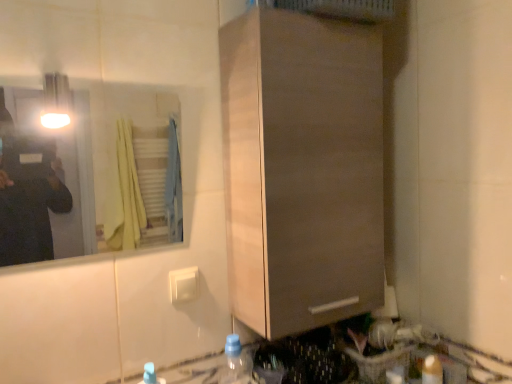
Question: Does translucent plastic bottle at lower right, the 1th bottle viewed from the right, come in front of blue translucent bottle at lower center, which is counted as the 3th bottle, starting from the right?

Choices:
 (A) no
 (B) yes

Answer: (A)

Question: From the image's perspective, is translucent plastic bottle at lower right, the 1th bottle viewed from the right, beneath blue translucent bottle at lower center, which is counted as the 3th bottle, starting from the right?

Choices:
 (A) yes
 (B) no

Answer: (A)

Question: From a real-world perspective, is translucent plastic bottle at lower right, the 1th bottle viewed from the right, on top of blue translucent bottle at lower center, which is counted as the 3th bottle, starting from the right?

Choices:
 (A) yes
 (B) no

Answer: (B)

Question: Does translucent plastic bottle at lower right, the 1th bottle viewed from the right, have a lesser width compared to blue translucent bottle at lower center, which is counted as the 3th bottle, starting from the right?

Choices:
 (A) no
 (B) yes

Answer: (B)

Question: From the image's perspective, is translucent plastic bottle at lower right, the 1th bottle viewed from the right, over blue translucent bottle at lower center, which is counted as the 3th bottle, starting from the right?

Choices:
 (A) no
 (B) yes

Answer: (A)

Question: From the image's perspective, relative to translucent plastic bottle at lower center, the 2th bottle from the right, is clear glass mirror at upper left above or below?

Choices:
 (A) above
 (B) below

Answer: (A)

Question: Do you think clear glass mirror at upper left is within translucent plastic bottle at lower center, the 2th bottle from the right, or outside of it?

Choices:
 (A) outside
 (B) inside

Answer: (A)

Question: Considering the positions of clear glass mirror at upper left and translucent plastic bottle at lower center, placed as the second bottle when sorted from left to right, in the image, is clear glass mirror at upper left wider or thinner than translucent plastic bottle at lower center, placed as the second bottle when sorted from left to right,?

Choices:
 (A) wide
 (B) thin

Answer: (B)

Question: Is point (31, 254) closer or farther from the camera than point (245, 352)?

Choices:
 (A) closer
 (B) farther

Answer: (B)

Question: From the image's perspective, is blue translucent bottle at lower center, which is counted as the 3th bottle, starting from the right, above or below translucent plastic bottle at lower center, the 2th bottle from the right?

Choices:
 (A) above
 (B) below

Answer: (A)

Question: Considering the positions of point (164, 380) and point (237, 337), is point (164, 380) closer or farther from the camera than point (237, 337)?

Choices:
 (A) farther
 (B) closer

Answer: (A)

Question: Looking at their shapes, would you say blue translucent bottle at lower center, which is counted as the 3th bottle, starting from the right, is wider or thinner than translucent plastic bottle at lower center, the 2th bottle from the right?

Choices:
 (A) thin
 (B) wide

Answer: (A)

Question: From a real-world perspective, relative to translucent plastic bottle at lower center, placed as the second bottle when sorted from left to right, is blue translucent bottle at lower center, marked as the 1th bottle in a left-to-right arrangement, vertically above or below?

Choices:
 (A) below
 (B) above

Answer: (B)

Question: Does point (250, 359) appear closer or farther from the camera than point (143, 380)?

Choices:
 (A) closer
 (B) farther

Answer: (B)

Question: Is translucent plastic bottle at lower center, the 2th bottle from the right, taller or shorter than blue translucent bottle at lower center, which is counted as the 3th bottle, starting from the right?

Choices:
 (A) short
 (B) tall

Answer: (B)